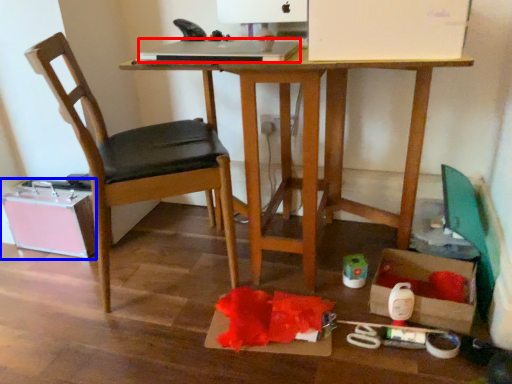
Question: Which of the following is the closest to the observer, laptop (highlighted by a red box) or storage box (highlighted by a blue box)?

Choices:
 (A) laptop
 (B) storage box

Answer: (A)